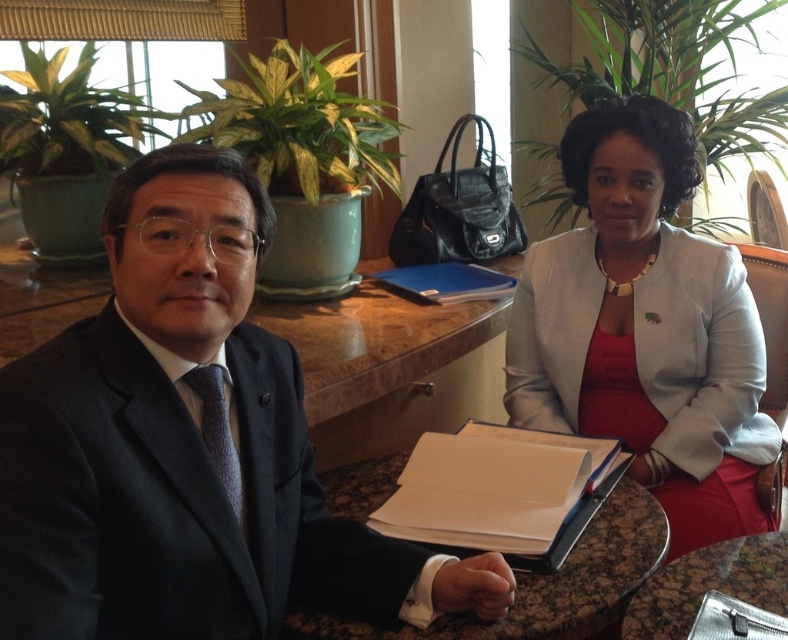
Question: Which object appears closest to the camera in this image?

Choices:
 (A) white matte blazer at center
 (B) dark brown textured tie at left
 (C) brown marble table at center

Answer: (B)

Question: Among these points, which one is farthest from the camera?

Choices:
 (A) (191, 380)
 (B) (307, 506)

Answer: (B)

Question: Is white matte blazer at center positioned behind brown marble table at center?

Choices:
 (A) yes
 (B) no

Answer: (A)

Question: Which object is closer to the camera taking this photo?

Choices:
 (A) white matte blazer at center
 (B) dark brown textured tie at left

Answer: (B)

Question: Considering the relative positions of dark blue suit at center and white matte blazer at center in the image provided, where is dark blue suit at center located with respect to white matte blazer at center?

Choices:
 (A) left
 (B) right

Answer: (A)

Question: Does white matte blazer at center have a larger size compared to brown marble table at center?

Choices:
 (A) no
 (B) yes

Answer: (B)